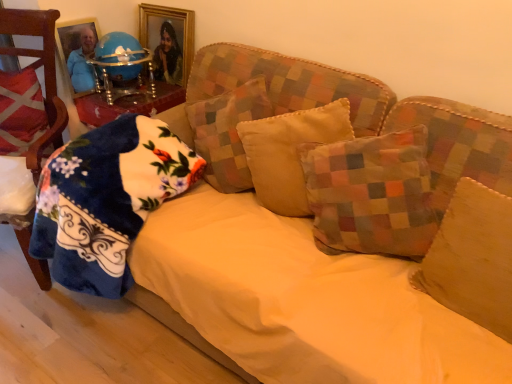
Question: Does patchwork fabric pillow at center, the 4th pillow viewed from the right, lie behind gold-framed picture at upper center?

Choices:
 (A) no
 (B) yes

Answer: (A)

Question: Is patchwork fabric pillow at center, positioned as the 3th pillow in left-to-right order, far from gold-framed picture at upper center?

Choices:
 (A) no
 (B) yes

Answer: (A)

Question: Does patchwork fabric pillow at center, positioned as the 3th pillow in left-to-right order, have a lesser width compared to gold-framed picture at upper center?

Choices:
 (A) no
 (B) yes

Answer: (A)

Question: Can you confirm if patchwork fabric pillow at center, positioned as the 3th pillow in left-to-right order, is taller than gold-framed picture at upper center?

Choices:
 (A) yes
 (B) no

Answer: (A)

Question: Is patchwork fabric pillow at center, the 4th pillow viewed from the right, to the left of gold-framed picture at upper center from the viewer's perspective?

Choices:
 (A) no
 (B) yes

Answer: (A)

Question: Relative to patchwork fabric pillow at center, the 4th pillow viewed from the right, is multicolored patchwork pillow at center, marked as the second pillow in a right-to-left arrangement, in front or behind?

Choices:
 (A) behind
 (B) front

Answer: (B)

Question: From the image's perspective, relative to patchwork fabric pillow at center, the 4th pillow viewed from the right, is multicolored patchwork pillow at center, marked as the second pillow in a right-to-left arrangement, above or below?

Choices:
 (A) above
 (B) below

Answer: (B)

Question: Considering the positions of multicolored patchwork pillow at center, the 5th pillow when ordered from left to right, and patchwork fabric pillow at center, positioned as the 3th pillow in left-to-right order, in the image, is multicolored patchwork pillow at center, the 5th pillow when ordered from left to right, wider or thinner than patchwork fabric pillow at center, positioned as the 3th pillow in left-to-right order,?

Choices:
 (A) wide
 (B) thin

Answer: (B)

Question: Choose the correct answer: Is multicolored patchwork pillow at center, the 5th pillow when ordered from left to right, inside patchwork fabric pillow at center, positioned as the 3th pillow in left-to-right order, or outside it?

Choices:
 (A) outside
 (B) inside

Answer: (A)

Question: From a real-world perspective, is velvet red chair at left positioned above or below yellow fabric sheet at center?

Choices:
 (A) below
 (B) above

Answer: (B)

Question: In the image, is velvet red chair at left positioned in front of or behind yellow fabric sheet at center?

Choices:
 (A) front
 (B) behind

Answer: (B)

Question: Looking at the image, does velvet red chair at left seem bigger or smaller compared to yellow fabric sheet at center?

Choices:
 (A) big
 (B) small

Answer: (B)

Question: In terms of width, does velvet red chair at left look wider or thinner when compared to yellow fabric sheet at center?

Choices:
 (A) wide
 (B) thin

Answer: (B)

Question: Is fluffy blue blanket at left, the second pillow in the left-to-right sequence, bigger or smaller than red plaid pillow at left, which ranks as the sixth pillow in right-to-left order?

Choices:
 (A) big
 (B) small

Answer: (A)

Question: Choose the correct answer: Is fluffy blue blanket at left, which is the fifth pillow in right-to-left order, inside red plaid pillow at left, which ranks as the sixth pillow in right-to-left order, or outside it?

Choices:
 (A) outside
 (B) inside

Answer: (A)